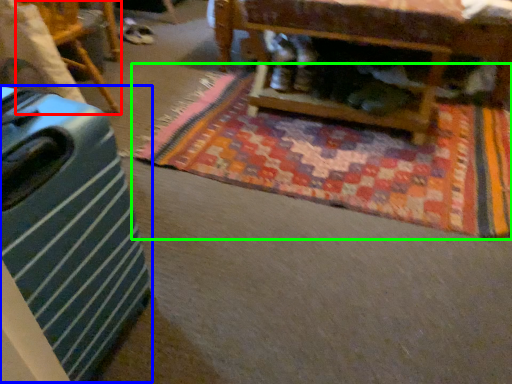
Question: Which is farther away from furniture (highlighted by a red box)? luggage (highlighted by a blue box) or mat (highlighted by a green box)?

Choices:
 (A) luggage
 (B) mat

Answer: (A)